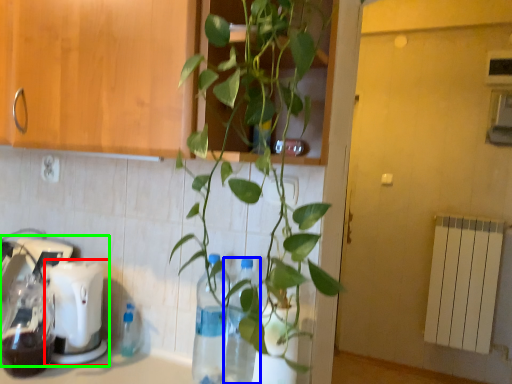
Question: Based on their relative distances, which object is nearer to coffee machine (highlighted by a red box)? Choose from glass bottle (highlighted by a blue box) and mixer (highlighted by a green box).

Choices:
 (A) glass bottle
 (B) mixer

Answer: (B)